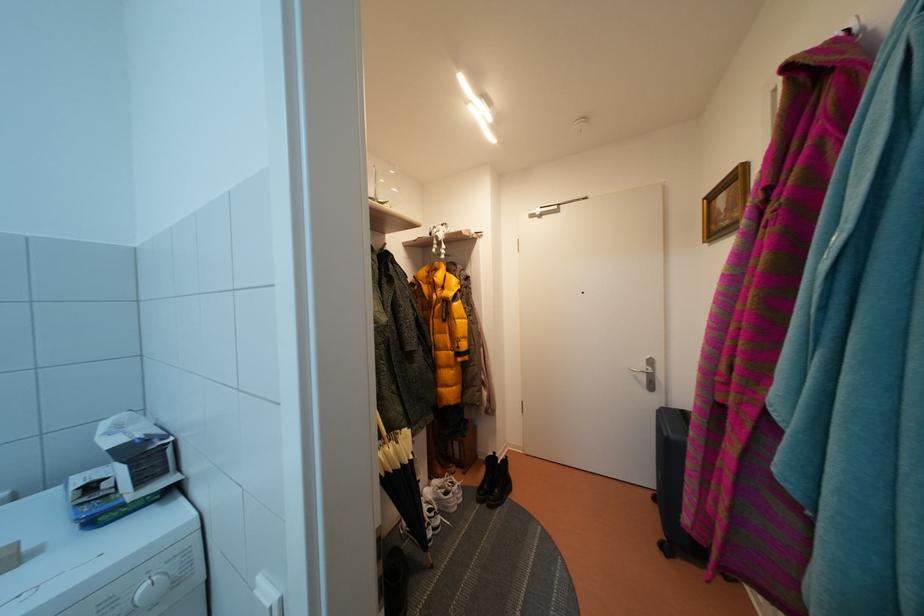
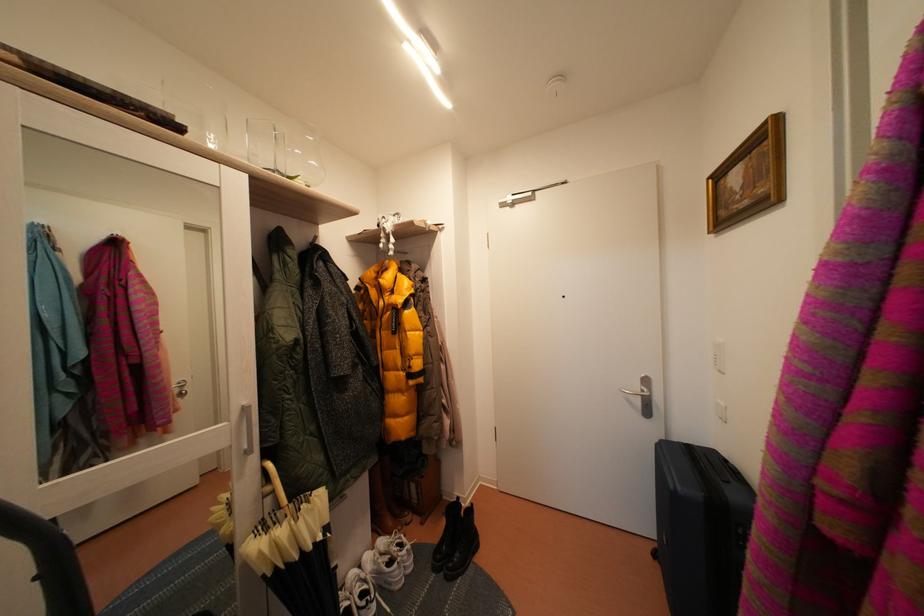
Question: Based on the continuous images, in which direction is the camera rotating? Reply with the corresponding letter.

Choices:
 (A) Left
 (B) Right
 (C) Up
 (D) Down

Answer: (B)